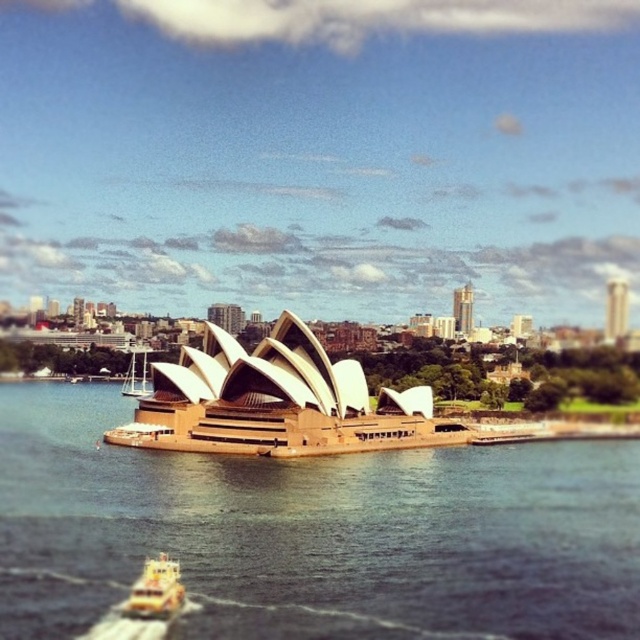
Question: Is brown water at center further to the viewer compared to yellow plastic boat at lower left?

Choices:
 (A) yes
 (B) no

Answer: (B)

Question: Does brown water at center appear over yellow plastic boat at lower left?

Choices:
 (A) yes
 (B) no

Answer: (B)

Question: Does brown water at center have a larger size compared to yellow plastic boat at lower left?

Choices:
 (A) no
 (B) yes

Answer: (B)

Question: Which point is farther to the camera?

Choices:
 (A) golden stone opera house at center
 (B) yellow plastic boat at lower left
 (C) brown water at center

Answer: (A)

Question: Which of the following is the closest to the observer?

Choices:
 (A) (67, 419)
 (B) (410, 422)

Answer: (B)

Question: Which object appears closest to the camera in this image?

Choices:
 (A) yellow plastic boat at lower left
 (B) brown water at center

Answer: (B)